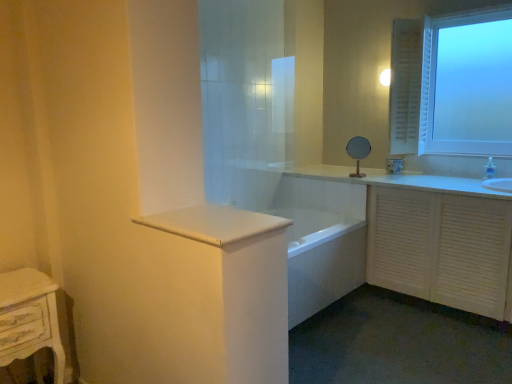
Question: From the image's perspective, relative to white distressed wood nightstand at lower left, is frosted glass window at upper right above or below?

Choices:
 (A) above
 (B) below

Answer: (A)

Question: Would you say frosted glass window at upper right is to the left or to the right of white distressed wood nightstand at lower left in the picture?

Choices:
 (A) left
 (B) right

Answer: (B)

Question: Which object is positioned farthest from the white wooden cabinet at right?

Choices:
 (A) frosted glass window at upper right
 (B) white distressed wood nightstand at lower left
 (C) white glossy bathtub at center
 (D) white glossy countertop at center

Answer: (B)

Question: Which is farther from the frosted glass window at upper right?

Choices:
 (A) white distressed wood nightstand at lower left
 (B) white glossy countertop at center
 (C) white wooden cabinet at right
 (D) white glossy bathtub at center

Answer: (A)